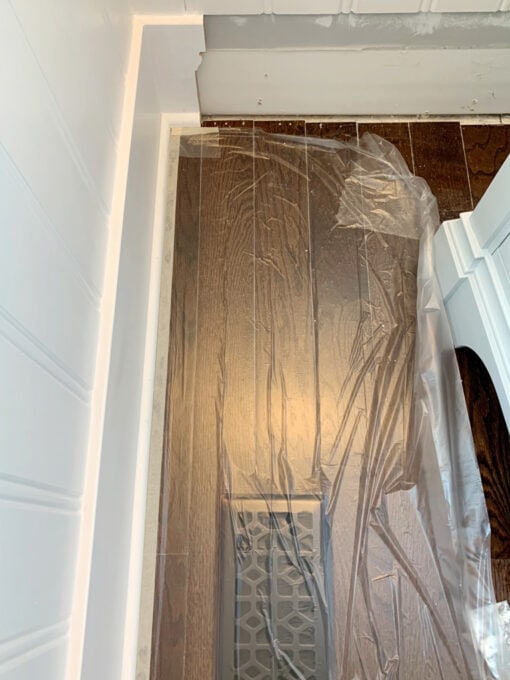
Locate an element on the screen. This screenshot has height=680, width=510. baseboard is located at coordinates (124, 362).